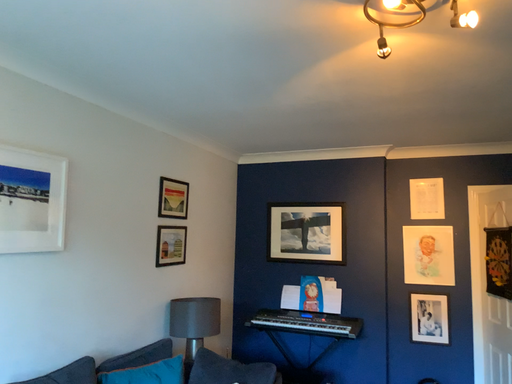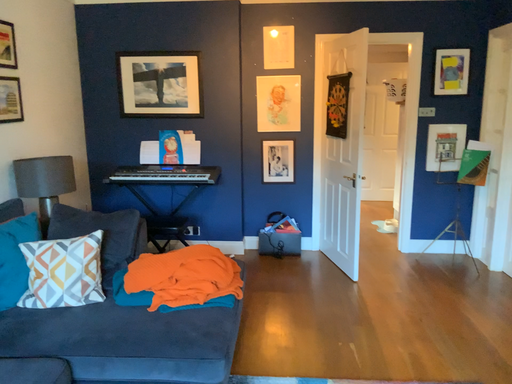
Question: Which way did the camera rotate in the video?

Choices:
 (A) rotated upward
 (B) rotated downward

Answer: (B)